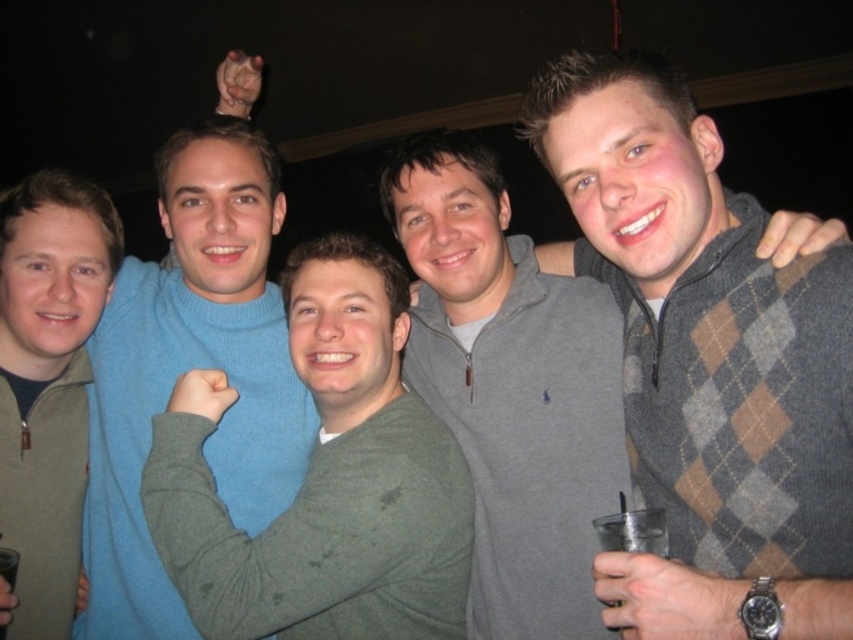
Is gray argyle sweater at center below matte green sweater at left?

Indeed, gray argyle sweater at center is positioned under matte green sweater at left.

Between gray argyle sweater at center and matte green sweater at left, which one has more height?

Standing taller between the two is gray argyle sweater at center.

Does point (532, 296) come farther from viewer compared to point (1, 212)?

That is True.

The image size is (853, 640). In order to click on gray argyle sweater at center in this screenshot , I will do `click(711, 323)`.

Is green fuzzy sweater at center wider than matte blue sweater at center?

Yes.

Which of these two, green fuzzy sweater at center or matte blue sweater at center, stands taller?

With more height is matte blue sweater at center.

Who is more forward, (335, 593) or (132, 545)?

Point (335, 593) is more forward.

The image size is (853, 640). What are the coordinates of `green fuzzy sweater at center` in the screenshot? It's located at (323, 480).

Who is taller, green fuzzy sweater at center or matte green sweater at left?

matte green sweater at left

Between point (335, 548) and point (30, 266), which one is positioned in front?

Point (335, 548) is in front.

This screenshot has height=640, width=853. Identify the location of green fuzzy sweater at center. (323, 480).